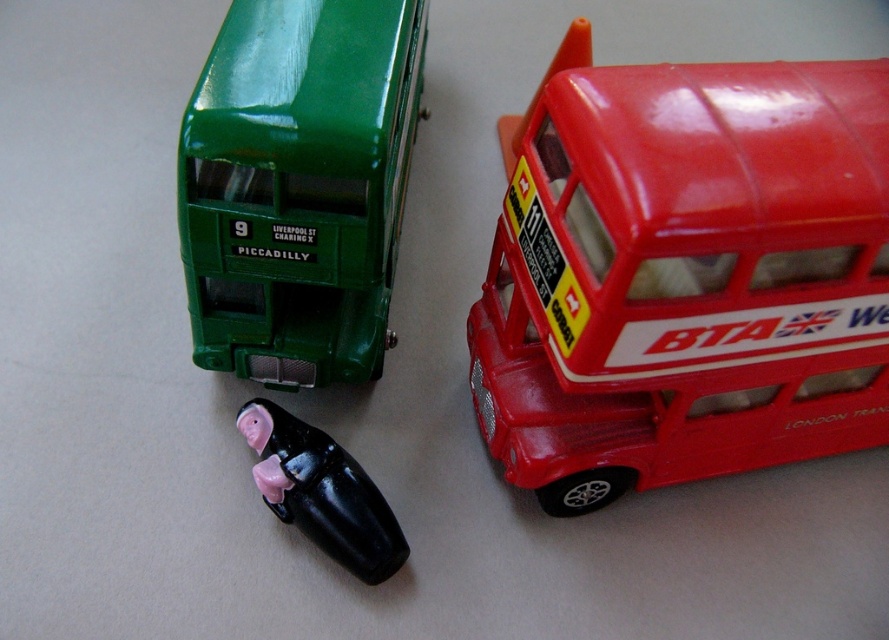
Image resolution: width=889 pixels, height=640 pixels. What do you see at coordinates (685, 275) in the screenshot?
I see `shiny plastic bus at upper right` at bounding box center [685, 275].

Does shiny plastic bus at upper right appear on the right side of green glossy bus at upper left?

Yes, shiny plastic bus at upper right is to the right of green glossy bus at upper left.

Which is in front, point (815, 317) or point (378, 300)?

Positioned in front is point (815, 317).

Where is `shiny plastic bus at upper right`? Image resolution: width=889 pixels, height=640 pixels. shiny plastic bus at upper right is located at coordinates (685, 275).

Does point (297, 369) lie in front of point (372, 556)?

No, (297, 369) is behind (372, 556).

Between green glossy bus at upper left and black glossy piglet at center, which one is positioned higher?

green glossy bus at upper left

Image resolution: width=889 pixels, height=640 pixels. Identify the location of green glossy bus at upper left. (298, 186).

Which is below, shiny plastic bus at upper right or black glossy piglet at center?

black glossy piglet at center is lower down.

Can you confirm if shiny plastic bus at upper right is positioned to the left of black glossy piglet at center?

In fact, shiny plastic bus at upper right is to the right of black glossy piglet at center.

In order to click on shiny plastic bus at upper right in this screenshot , I will do `click(685, 275)`.